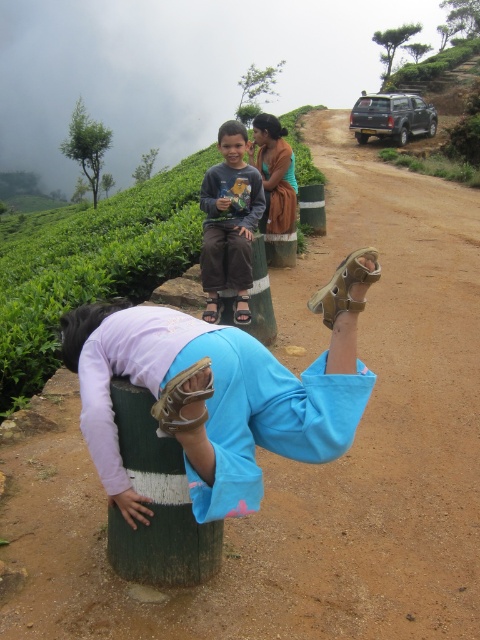
Based on the photo, is the position of green wood pole at lower center more distant than that of brown textured dress at upper center?

No, it is in front of brown textured dress at upper center.

Locate an element on the screen. green wood pole at lower center is located at coordinates (156, 502).

Is point (216, 257) positioned after point (290, 147)?

No, it is in front of (290, 147).

Does dark gray fabric shirt at center have a smaller size compared to brown textured dress at upper center?

No.

You are a GUI agent. You are given a task and a screenshot of the screen. Output one action in this format:
    pyautogui.click(x=<x>, y=<y>)
    Task: Click on the dark gray fabric shirt at center
    The width and height of the screenshot is (480, 640).
    Given the screenshot: What is the action you would take?
    229,221

Identify the location of dark gray fabric shirt at center. Image resolution: width=480 pixels, height=640 pixels. (229, 221).

Which is below, blue fabric squat at center or dark gray fabric shirt at center?

blue fabric squat at center is below.

Based on the photo, between blue fabric squat at center and dark gray fabric shirt at center, which one appears on the right side from the viewer's perspective?

From the viewer's perspective, dark gray fabric shirt at center appears more on the right side.

Is point (231, 353) positioned in front of point (204, 278)?

Yes, point (231, 353) is in front of point (204, 278).

Where is `blue fabric squat at center`? The width and height of the screenshot is (480, 640). blue fabric squat at center is located at coordinates (220, 392).